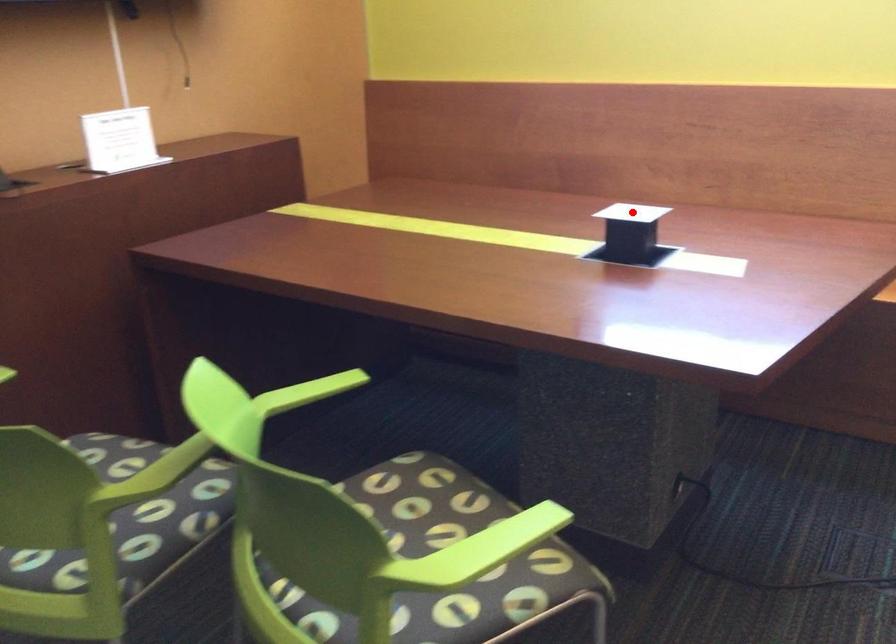
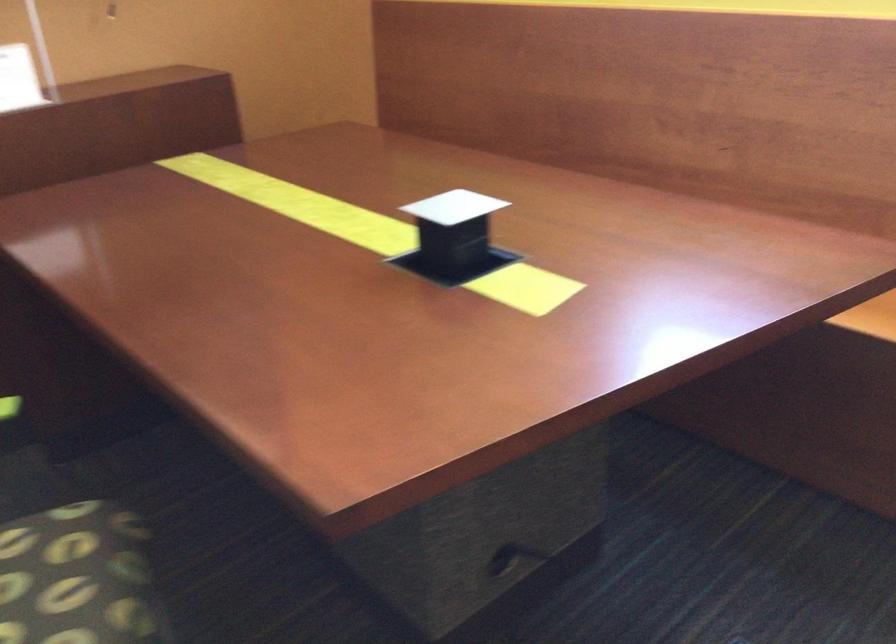
Question: I am providing you with two images of the same scene from different viewpoints. Given a red point in image1, look at the same physical point in image2. Is it:

Choices:
 (A) Closer to the viewpoint
 (B) Farther from the viewpoint

Answer: (A)